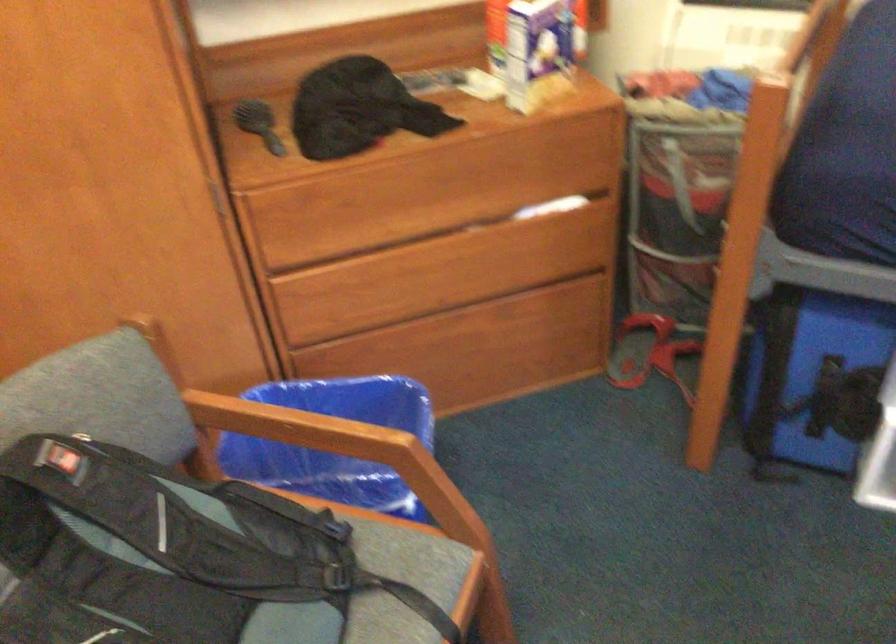
Where would you resting arm the wooden chair armrest? Please return your answer as a coordinate pair (x, y).

(290, 424)